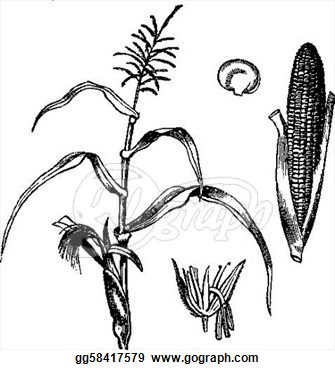
This screenshot has height=370, width=335. I want to click on art, so click(x=210, y=294).